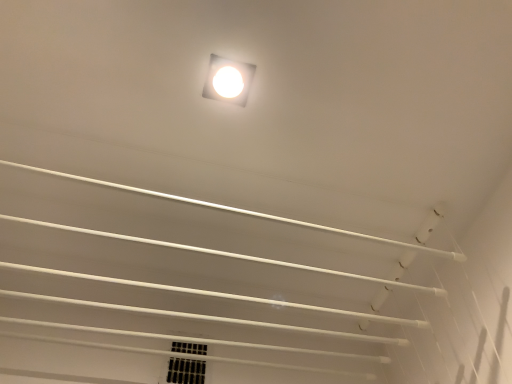
What do you see at coordinates (186, 371) in the screenshot? I see `black mesh vent at lower center` at bounding box center [186, 371].

This screenshot has height=384, width=512. What are the coordinates of `black mesh vent at lower center` in the screenshot? It's located at (186, 371).

Identify the location of white glossy square lamp at upper center. This screenshot has width=512, height=384. (228, 80).

The width and height of the screenshot is (512, 384). Describe the element at coordinates (228, 80) in the screenshot. I see `white glossy square lamp at upper center` at that location.

Locate an element on the screen. This screenshot has width=512, height=384. black mesh vent at lower center is located at coordinates (186, 371).

Visually, is white glossy square lamp at upper center positioned to the left or to the right of black mesh vent at lower center?

white glossy square lamp at upper center is positioned on black mesh vent at lower center's right side.

Is white glossy square lamp at upper center closer to camera compared to black mesh vent at lower center?

That is True.

Between point (214, 71) and point (172, 379), which one is positioned in front?

The point (214, 71) is in front.

From the image's perspective, is white glossy square lamp at upper center above black mesh vent at lower center?

Yes.

From a real-world perspective, is white glossy square lamp at upper center physically above black mesh vent at lower center?

Yes.

In terms of width, does white glossy square lamp at upper center look wider or thinner when compared to black mesh vent at lower center?

Clearly, white glossy square lamp at upper center has more width compared to black mesh vent at lower center.

From their relative heights in the image, would you say white glossy square lamp at upper center is taller or shorter than black mesh vent at lower center?

In the image, white glossy square lamp at upper center appears to be shorter than black mesh vent at lower center.

Based on the photo, based on their sizes in the image, would you say white glossy square lamp at upper center is bigger or smaller than black mesh vent at lower center?

Considering their sizes, white glossy square lamp at upper center takes up less space than black mesh vent at lower center.

Is white glossy square lamp at upper center located outside black mesh vent at lower center?

white glossy square lamp at upper center lies outside black mesh vent at lower center's area.

Is white glossy square lamp at upper center with black mesh vent at lower center?

No, white glossy square lamp at upper center is not beside black mesh vent at lower center.

Is white glossy square lamp at upper center turned away from black mesh vent at lower center?

That's not correct — white glossy square lamp at upper center is not looking away from black mesh vent at lower center.

What's the angular difference between white glossy square lamp at upper center and black mesh vent at lower center's facing directions?

There is a 2.11-degree angle between the facing directions of white glossy square lamp at upper center and black mesh vent at lower center.

This screenshot has width=512, height=384. I want to click on lamp on the right of black mesh vent at lower center, so click(x=228, y=80).

Is black mesh vent at lower center to the left or to the right of white glossy square lamp at upper center in the image?

Based on their positions, black mesh vent at lower center is located to the left of white glossy square lamp at upper center.

Is the depth of black mesh vent at lower center greater than that of white glossy square lamp at upper center?

Yes, black mesh vent at lower center is further from the camera.

Considering the positions of points (187, 378) and (238, 65), is point (187, 378) closer to camera compared to point (238, 65)?

No, it is behind (238, 65).

From the image's perspective, is black mesh vent at lower center above white glossy square lamp at upper center?

Actually, black mesh vent at lower center appears below white glossy square lamp at upper center in the image.

From a real-world perspective, which is physically below, black mesh vent at lower center or white glossy square lamp at upper center?

From a 3D spatial view, black mesh vent at lower center is below.

Does black mesh vent at lower center have a lesser width compared to white glossy square lamp at upper center?

Correct, the width of black mesh vent at lower center is less than that of white glossy square lamp at upper center.

Considering the sizes of black mesh vent at lower center and white glossy square lamp at upper center in the image, is black mesh vent at lower center taller or shorter than white glossy square lamp at upper center?

Considering their sizes, black mesh vent at lower center has more height than white glossy square lamp at upper center.

Considering the sizes of objects black mesh vent at lower center and white glossy square lamp at upper center in the image provided, who is bigger, black mesh vent at lower center or white glossy square lamp at upper center?

black mesh vent at lower center.

Consider the image. Is white glossy square lamp at upper center a part of black mesh vent at lower center?

Definitely not — white glossy square lamp at upper center is not inside black mesh vent at lower center.

Are black mesh vent at lower center and white glossy square lamp at upper center making contact?

black mesh vent at lower center is not next to white glossy square lamp at upper center, and they're not touching.

Is black mesh vent at lower center oriented towards white glossy square lamp at upper center?

Yes, black mesh vent at lower center is oriented towards white glossy square lamp at upper center.

How different are the orientations of black mesh vent at lower center and white glossy square lamp at upper center in degrees?

They differ by 2.11 degrees in their facing directions.

In order to click on lamp above the black mesh vent at lower center (from a real-world perspective) in this screenshot , I will do `click(228, 80)`.

This screenshot has height=384, width=512. I want to click on lamp located in front of the black mesh vent at lower center, so click(228, 80).

This screenshot has height=384, width=512. Identify the location of window below the white glossy square lamp at upper center (from the image's perspective). (186, 371).